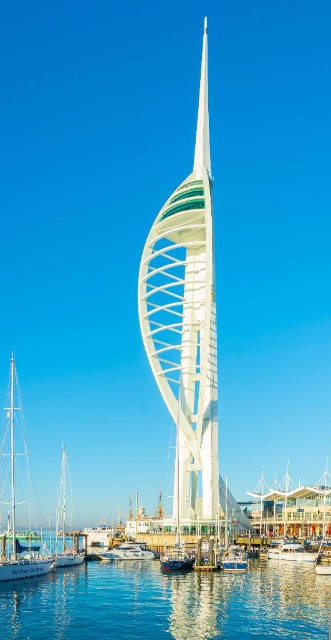
You are standing on the marina shore and want to take a photo of the white glass tower at center. Your camera can focus on objects up to 100 meters away. Will the tower be in focus?

The white glass tower at center is 110.01 meters away from the viewer. Since the camera can only focus up to 100 meters, the tower will be out of focus.

You are standing at the base of the Spinnaker Tower and looking up at its structure. There are two points marked on the tower, one at coordinates point (173,320) and the other at point (236,572). Which of these two points is closer to your eye level when you look straight ahead?

Point (173,320) is further to the camera than point (236,572). Therefore, point (236,572) is closer to your eye level when looking straight ahead.

What are the coordinates of the white sailboat at lower left?

The white sailboat at lower left is located at coordinates point (14, 513).